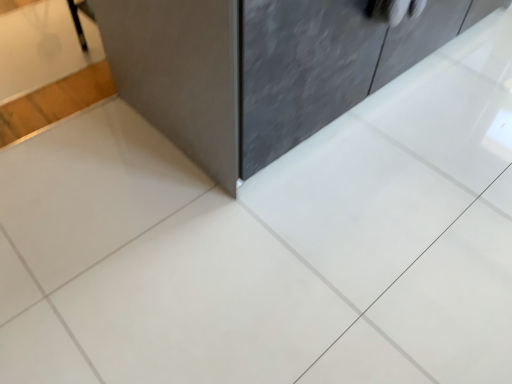
This screenshot has width=512, height=384. What do you see at coordinates (47, 69) in the screenshot? I see `wooden at left` at bounding box center [47, 69].

Image resolution: width=512 pixels, height=384 pixels. Find the location of `wooden at left`. wooden at left is located at coordinates (47, 69).

Image resolution: width=512 pixels, height=384 pixels. Find the location of `wooden at left`. wooden at left is located at coordinates (47, 69).